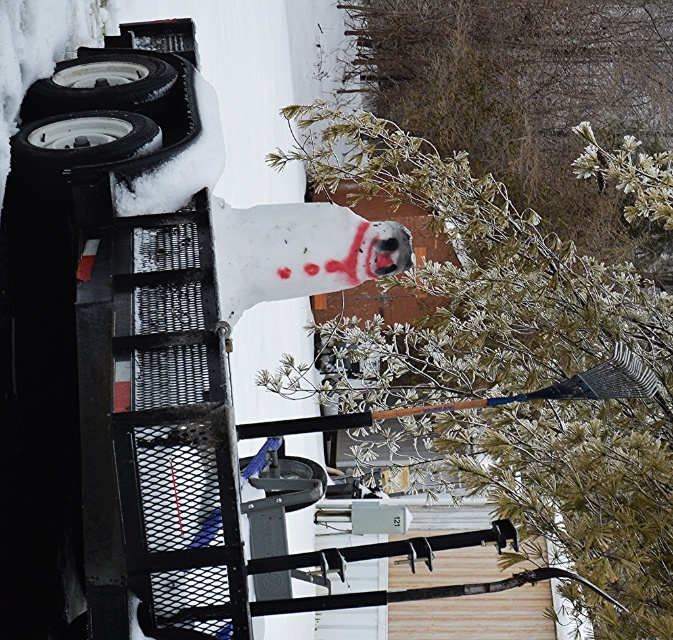
You are standing at the point where the snow is thickest in the image. There is a snow covered pine at center located at point (x=518, y=364). Can you tell me the exact coordinates of the snow covered pine at center?

The snow covered pine at center is located at point (x=518, y=364).

Based on the photo, you are an observer looking at the snowy scene. You see the frosted pine branches at upper center and the white painted skull at center. Which object is located to the right of the other?

The frosted pine branches at upper center is positioned on the right side of white painted skull at center.